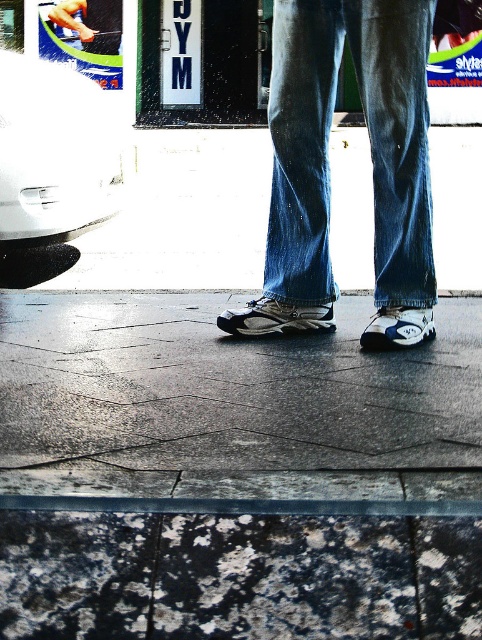
You are a photographer trying to capture a detailed shot of both the white mesh shoe at center and the white synthetic sneaker at center. Since you want to focus on the front parts of both shoes, which one should you adjust your camera angle to prioritize? Explain your reasoning based on their positions.

The white synthetic sneaker at center is behind the white mesh shoe at center, so to focus on the front parts of both shoes, you should adjust your camera angle to prioritize the white mesh shoe at center. This way, you can capture the front of the white mesh shoe without it being blocked by the white synthetic sneaker behind it.

You are a fashion designer analyzing the image. You need to determine which item of clothing reaches higher on the person. Which one is taller between the blue denim jeans at center and the white mesh shoe at center?

The blue denim jeans at center is much taller as the white mesh shoe at center, so the blue denim jeans at center reaches higher on the person.

You are a shoe designer observing the image. You need to determine which shoe to recommend for a customer who wants a narrower fit. Which one between the white mesh shoe at center and the white synthetic sneaker at center should you suggest?

The white synthetic sneaker at center has a narrower width compared to the white mesh shoe at center, so it is the better recommendation for a customer seeking a narrower fit.